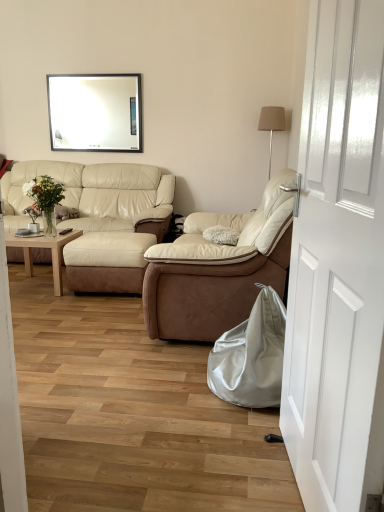
Where is `free space above white glossy mirror at upper center (from a real-world perspective)`? The height and width of the screenshot is (512, 384). free space above white glossy mirror at upper center (from a real-world perspective) is located at coordinates (96, 71).